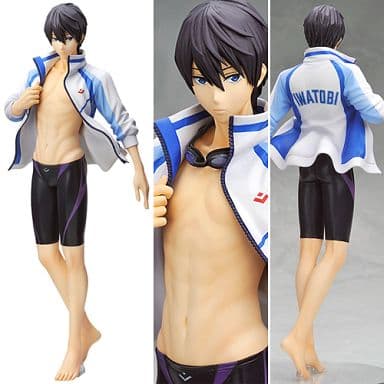
I want to click on chest, so click(x=55, y=96), click(x=198, y=207).